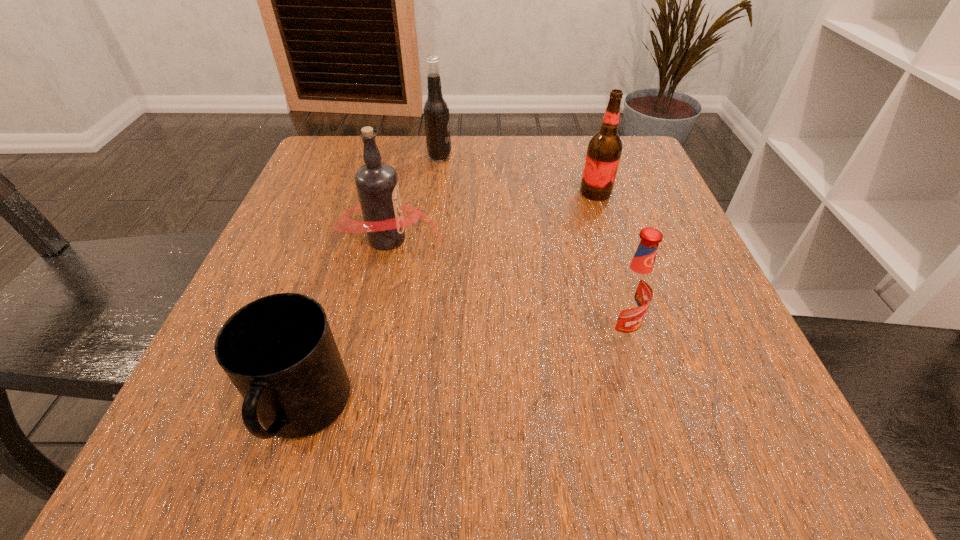
The width and height of the screenshot is (960, 540). Find the location of `the farthest object`. the farthest object is located at coordinates (436, 111).

I want to click on the third farthest object, so click(377, 186).

At what (x,y) coordinates should I click in order to perform the action: click on the third nearest root beer. Please return your answer as a coordinate pair (x, y). The image size is (960, 540). Looking at the image, I should click on (604, 150).

Where is `the fourth farthest object`? The width and height of the screenshot is (960, 540). the fourth farthest object is located at coordinates (632, 290).

Identify the location of the shortest object. The height and width of the screenshot is (540, 960). (279, 352).

Where is `the nearest object`? the nearest object is located at coordinates (279, 352).

This screenshot has height=540, width=960. What are the coordinates of `vacant region located 0.300m on the label of the farthest object` in the screenshot? It's located at (583, 157).

Locate an element on the screen. This screenshot has width=960, height=540. free space located 0.090m on the label of the third farthest root beer is located at coordinates [x=491, y=239].

Locate an element on the screen. vacant space located 0.240m on the front of the second farthest object is located at coordinates (627, 288).

Image resolution: width=960 pixels, height=540 pixels. In order to click on free space located 0.090m on the front of the fourth farthest object in this screenshot , I will do `click(637, 407)`.